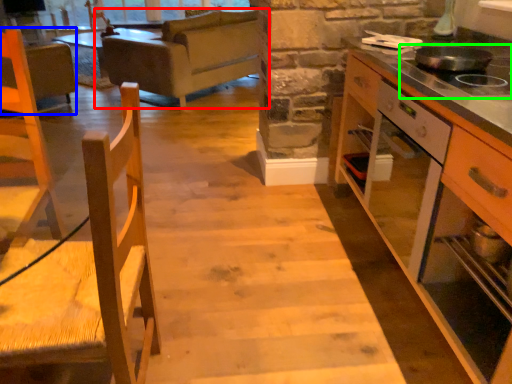
Question: Which object is the closest to the studio couch (highlighted by a red box)? Choose among these: armchair (highlighted by a blue box) or gas stove (highlighted by a green box).

Choices:
 (A) armchair
 (B) gas stove

Answer: (A)